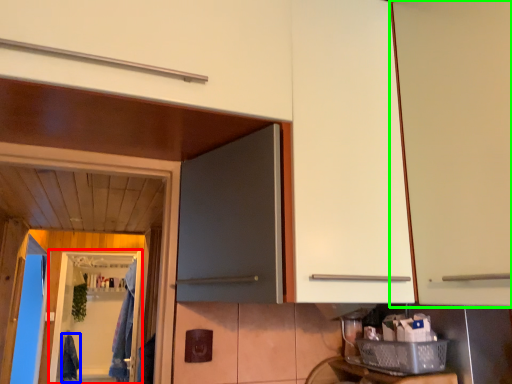
Question: Which object is the closest to the screen door (highlighted by a red box)? Choose among these: laundry (highlighted by a blue box) or cabinetry (highlighted by a green box).

Choices:
 (A) laundry
 (B) cabinetry

Answer: (A)